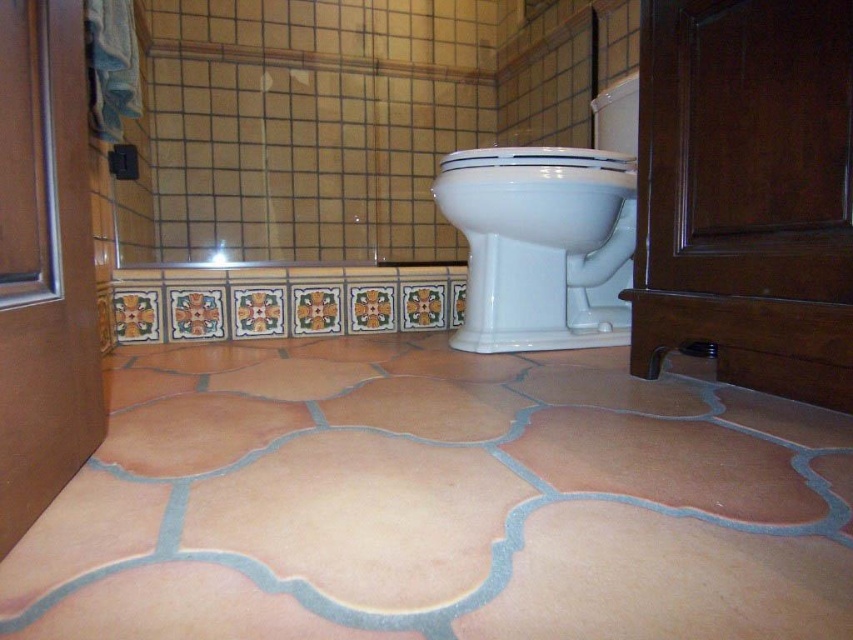
Does terracotta textured tile at center appear on the right side of white glossy toilet bowl at center?

No, terracotta textured tile at center is not to the right of white glossy toilet bowl at center.

Who is positioned more to the right, terracotta textured tile at center or white glossy toilet bowl at center?

From the viewer's perspective, white glossy toilet bowl at center appears more on the right side.

The image size is (853, 640). What do you see at coordinates (437, 502) in the screenshot?
I see `terracotta textured tile at center` at bounding box center [437, 502].

The image size is (853, 640). Identify the location of terracotta textured tile at center. click(437, 502).